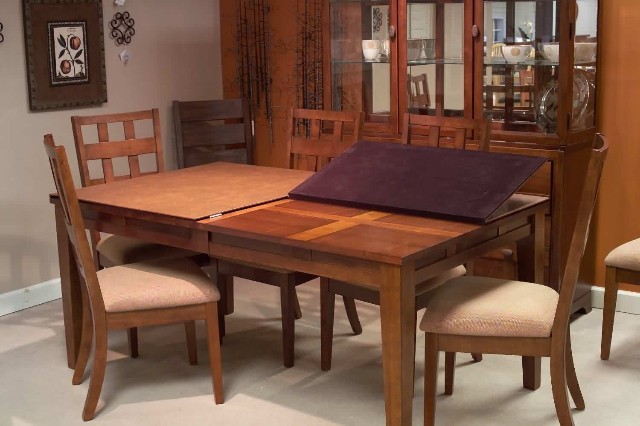
Image resolution: width=640 pixels, height=426 pixels. In order to click on wainscotting in this screenshot , I will do `click(29, 299)`, `click(635, 302)`.